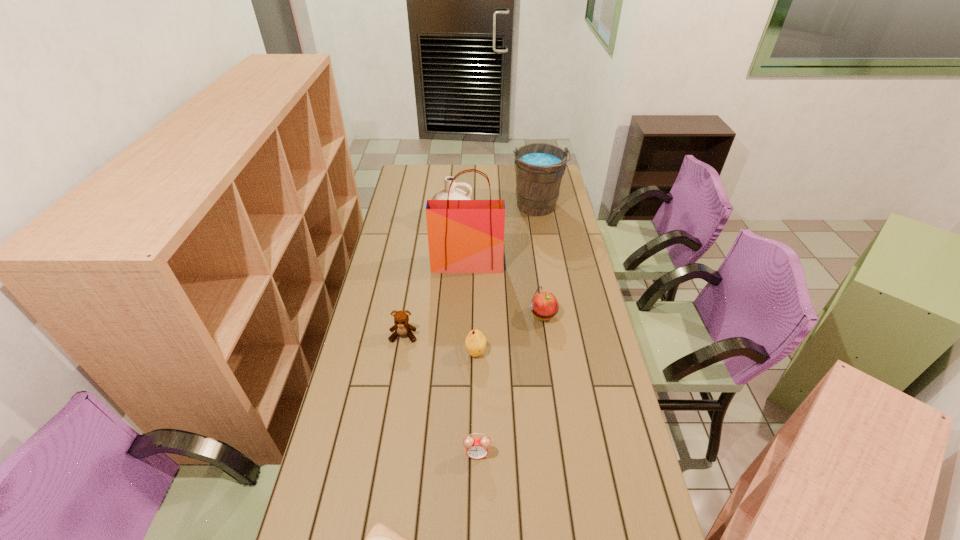
Locate an element on the screen. The image size is (960, 540). shopping bag is located at coordinates (464, 236).

What are the coordinates of `the sixth nearest object` in the screenshot? It's located at (464, 236).

Locate an element on the screen. The width and height of the screenshot is (960, 540). wine bucket is located at coordinates pos(539,167).

Where is `pottery`? The width and height of the screenshot is (960, 540). pottery is located at coordinates (454, 194).

You are a GUI agent. You are given a task and a screenshot of the screen. Output one action in this format:
    pyautogui.click(x=<x>, y=<y>)
    Task: Click on the apple
    This screenshot has height=540, width=960.
    Given the screenshot: What is the action you would take?
    pyautogui.click(x=544, y=305)

The width and height of the screenshot is (960, 540). Find the location of `teddy bear`. teddy bear is located at coordinates point(402,327).

You are a GUI agent. You are given a task and a screenshot of the screen. Output one action in this format:
    pyautogui.click(x=<x>, y=<y>)
    Task: Click on the pear
    
    Given the screenshot: What is the action you would take?
    pyautogui.click(x=475, y=342)

You are a GUI agent. You are given a task and a screenshot of the screen. Output one action in this format:
    pyautogui.click(x=<x>, y=<y>)
    Task: Click on the second nearest object
    
    Given the screenshot: What is the action you would take?
    pyautogui.click(x=477, y=448)

Locate an element on the screen. free space located on the handle side of the tallest object is located at coordinates (466, 295).

At what (x,y) coordinates should I click in order to perform the action: click on vacant space located with a handle on the side of the wine bucket. Please return your answer as a coordinate pair (x, y). The image size is (960, 540). Looking at the image, I should click on (543, 247).